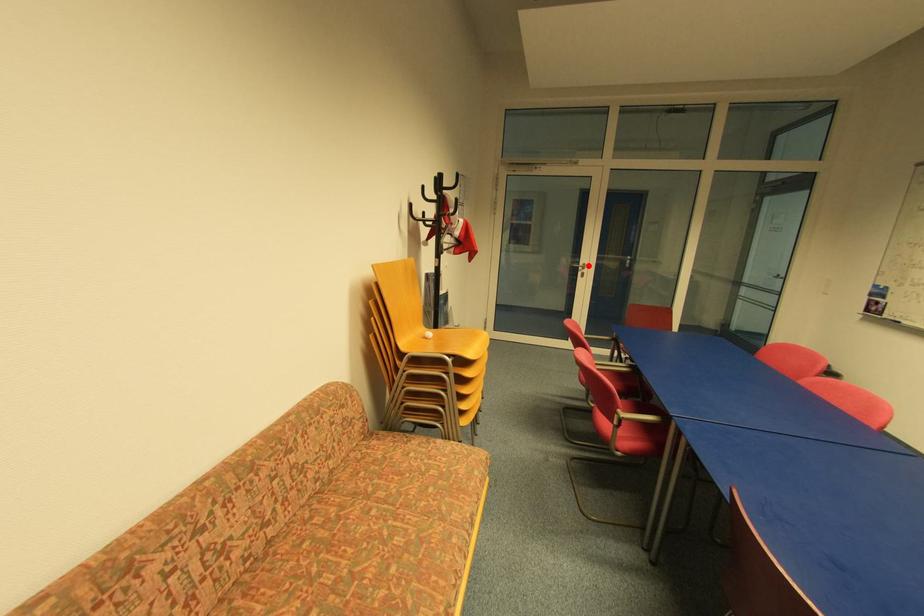
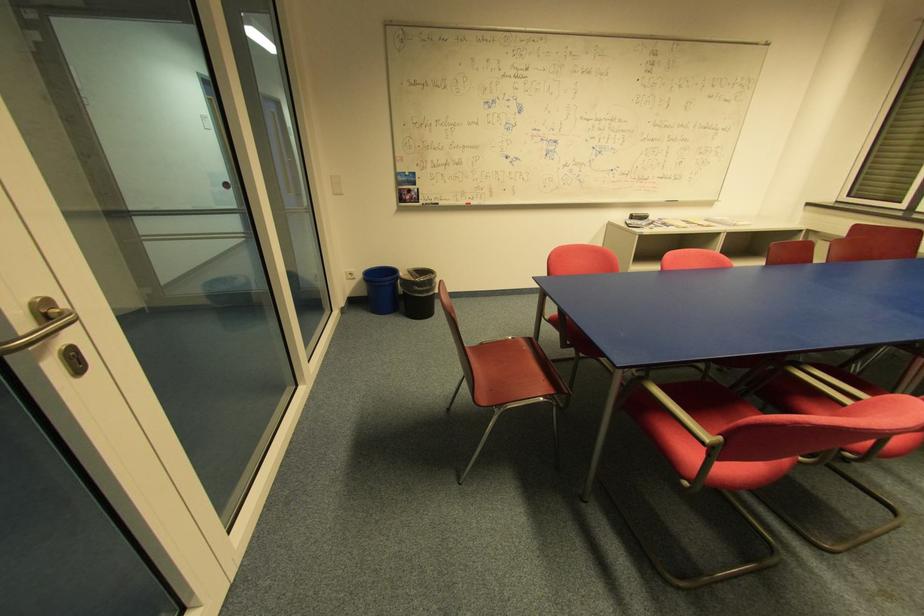
In the second image, find the point that corresponds to the highlighted location in the first image.

(51, 304)